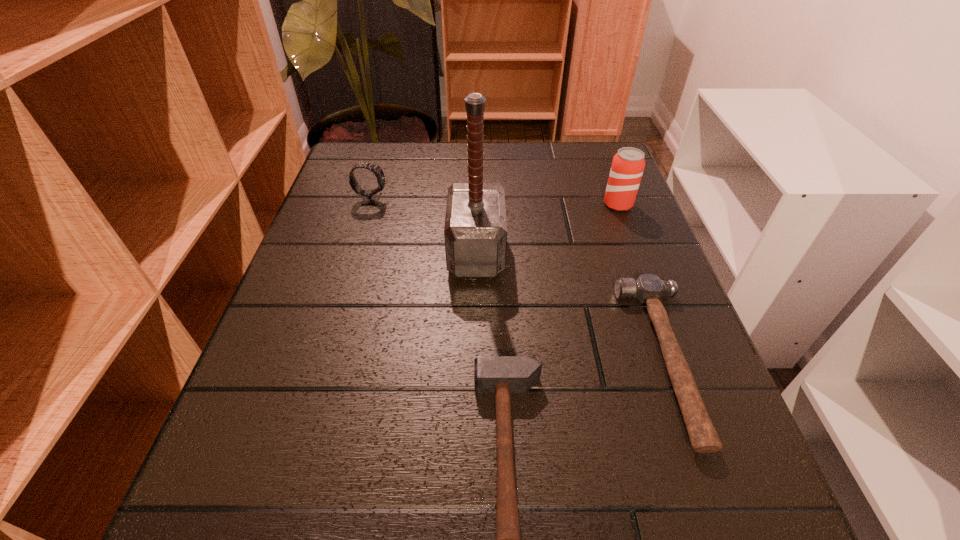
You are a GUI agent. You are given a task and a screenshot of the screen. Output one action in this format:
    pyautogui.click(x=<x>, y=<y>)
    Task: Click on the closest object to the fourth shortest object
    The image size is (960, 540).
    Given the screenshot: What is the action you would take?
    pyautogui.click(x=648, y=288)

Select which object appears as the third closest to the beer can. Please provide its 2D coordinates. Your answer should be formatted as a tuple, i.e. [(x, y)], where the tuple contains the x and y coordinates of a point satisfying the conditions above.

[(501, 375)]

Where is `the second closest hammer to the rightmost hammer`? The height and width of the screenshot is (540, 960). the second closest hammer to the rightmost hammer is located at coordinates (475, 232).

Identify the location of hammer that is the second closest to the rightmost hammer. The width and height of the screenshot is (960, 540). (475, 232).

Locate an element on the screen. The image size is (960, 540). free space that satisfies the following two spatial constraints: 1. on the face of the third tallest object; 2. on the left side of the third farthest object is located at coordinates (355, 252).

Find the location of a particular element. free spot that satisfies the following two spatial constraints: 1. on the face of the watch; 2. on the right side of the third farthest object is located at coordinates (355, 252).

Where is `free spot that satisfies the following two spatial constraints: 1. on the face of the watch; 2. on the back side of the tallest object`? This screenshot has height=540, width=960. free spot that satisfies the following two spatial constraints: 1. on the face of the watch; 2. on the back side of the tallest object is located at coordinates (355, 252).